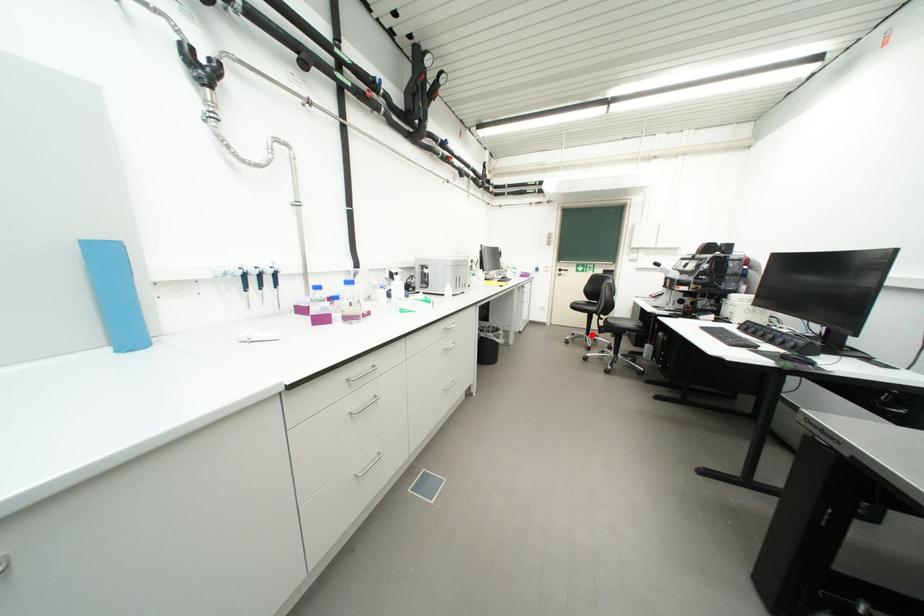
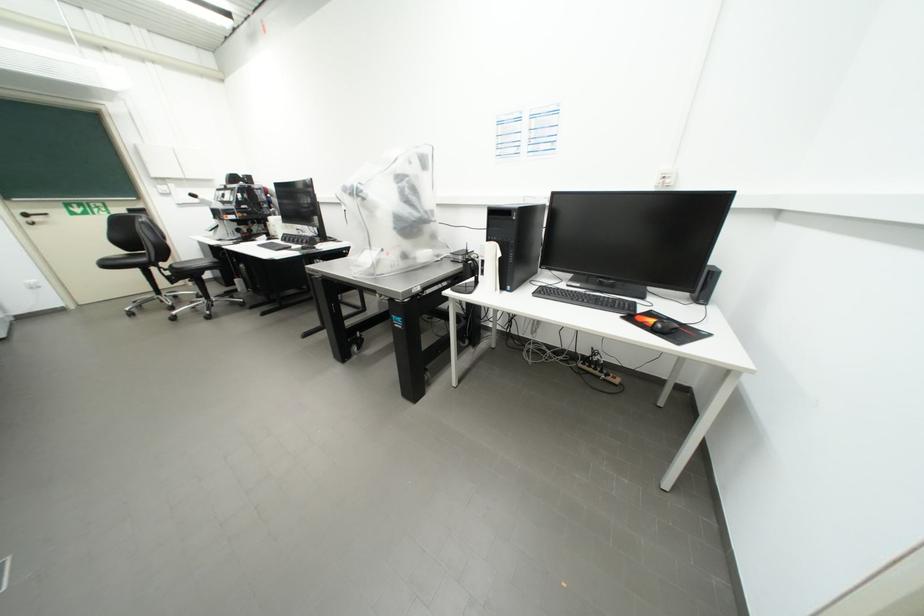
Question: I am providing you with two images of the same scene from different viewpoints. Image1 has a red point marked. In image2, the corresponding 3D location appears at what relative position? Reply with the corresponding letter.

Choices:
 (A) Closer
 (B) Farther

Answer: (B)